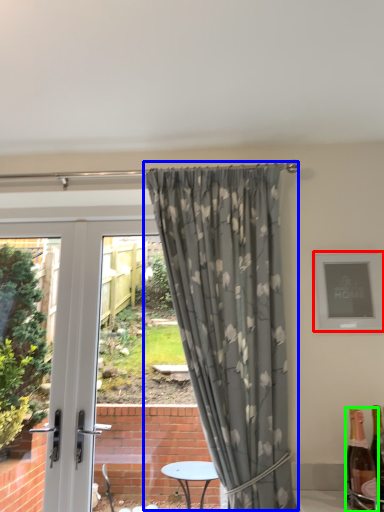
Question: Estimate the real-world distances between objects in this image. Which object is farther from picture frame (highlighted by a red box), curtain (highlighted by a blue box) or bottle (highlighted by a green box)?

Choices:
 (A) curtain
 (B) bottle

Answer: (B)